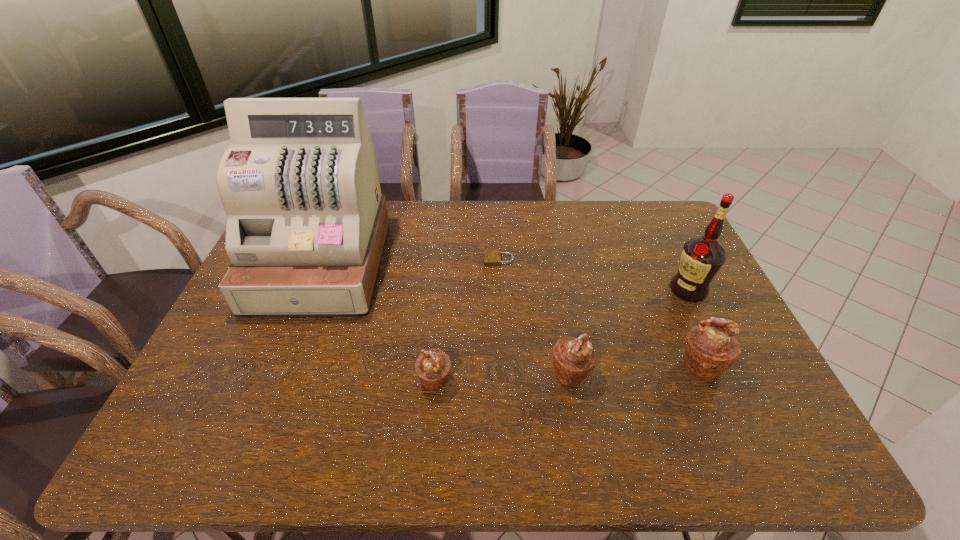
I want to click on vacant area at the far right corner of the desktop, so click(x=662, y=233).

At what (x,y) coordinates should I click in order to perform the action: click on vacant space in between the fifth object from right to left and the leftmost object. Please return your answer as a coordinate pair (x, y). Image resolution: width=960 pixels, height=540 pixels. Looking at the image, I should click on (378, 323).

The image size is (960, 540). Identify the location of free space between the second object from left to right and the cash register. (378, 323).

Where is `free space that is in between the second object from left to right and the fourth object from right to left`? free space that is in between the second object from left to right and the fourth object from right to left is located at coordinates (467, 320).

This screenshot has height=540, width=960. What are the coordinates of `free space between the third object from left to right and the rightmost muffin` in the screenshot? It's located at (600, 313).

Locate an element on the screen. free space between the padlock and the leftmost object is located at coordinates (410, 262).

Find the location of a particular element. free space between the rightmost muffin and the cash register is located at coordinates (511, 315).

Image resolution: width=960 pixels, height=540 pixels. I want to click on empty location between the padlock and the leftmost object, so click(410, 262).

Locate an element on the screen. The image size is (960, 540). vacant area that lies between the second muffin from right to left and the leftmost muffin is located at coordinates (502, 377).

Where is `empty space that is in between the tallest object and the alcohol`? Image resolution: width=960 pixels, height=540 pixels. empty space that is in between the tallest object and the alcohol is located at coordinates (504, 278).